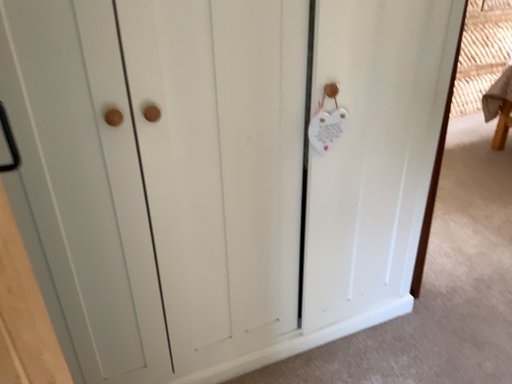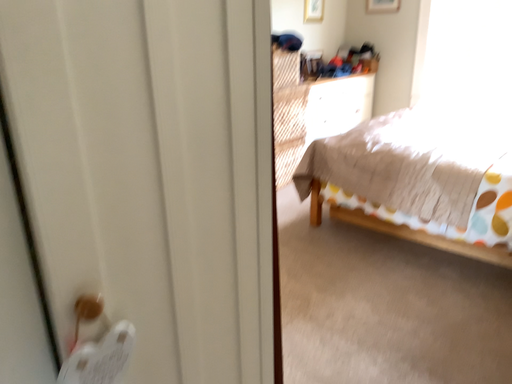
Question: Which way did the camera rotate in the video?

Choices:
 (A) rotated right
 (B) rotated left

Answer: (A)